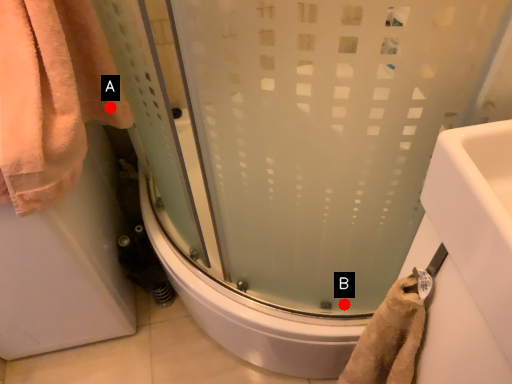
Question: Two points are circled on the image, labeled by A and B beside each circle. Among these points, which one is farthest from the camera?

Choices:
 (A) A is further
 (B) B is further

Answer: (B)